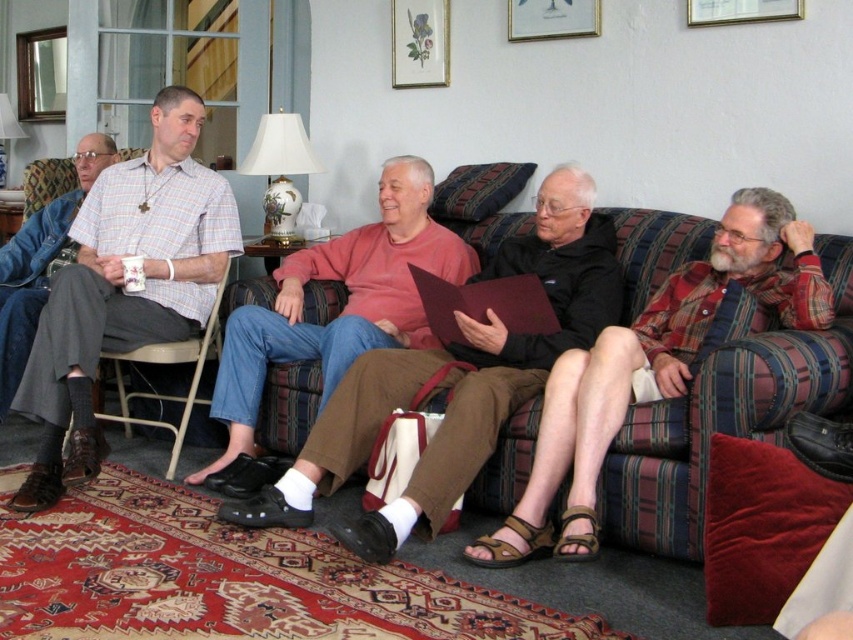
Is matte red sweater at center to the left of gold-framed picture at upper center from the viewer's perspective?

Indeed, matte red sweater at center is positioned on the left side of gold-framed picture at upper center.

Is point (383, 300) farther from viewer compared to point (741, 17)?

Yes, it is.

The width and height of the screenshot is (853, 640). What do you see at coordinates (341, 308) in the screenshot?
I see `matte red sweater at center` at bounding box center [341, 308].

The image size is (853, 640). I want to click on matte red sweater at center, so click(x=341, y=308).

Can you confirm if wooden picture frame at upper center is bigger than gold-framed picture at upper center?

Indeed, wooden picture frame at upper center has a larger size compared to gold-framed picture at upper center.

Between wooden picture frame at upper center and gold-framed picture at upper center, which one has more height?

wooden picture frame at upper center is taller.

Locate an element on the screen. The image size is (853, 640). wooden picture frame at upper center is located at coordinates (552, 19).

Is point (212, 282) closer to camera compared to point (13, 278)?

Yes, it is.

From the picture: Between plaid shirt at left and matte plaid shirt at left, which one is positioned higher?

matte plaid shirt at left is above.

Who is more forward, (167, 108) or (20, 241)?

Point (167, 108) is more forward.

This screenshot has width=853, height=640. In order to click on plaid shirt at left in this screenshot , I will do `click(125, 285)`.